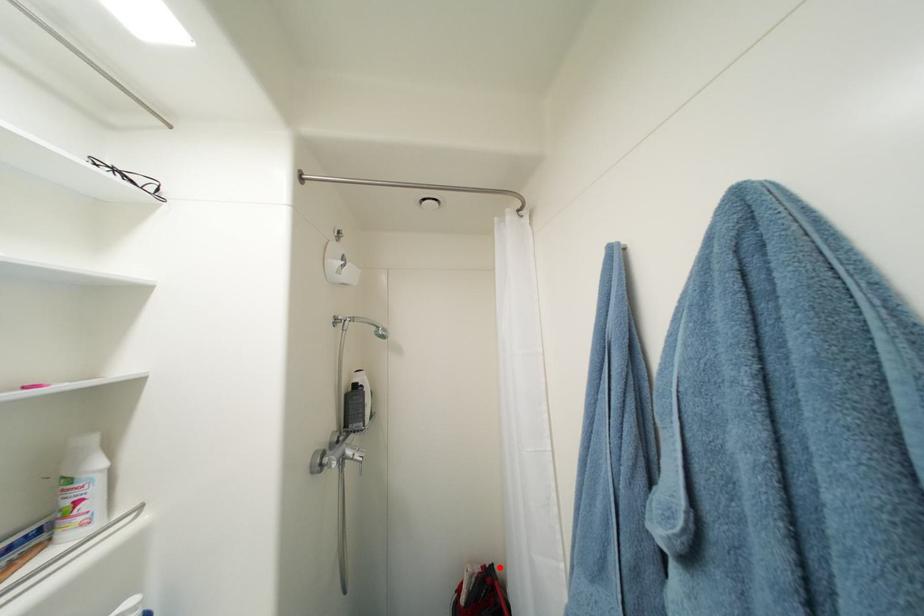
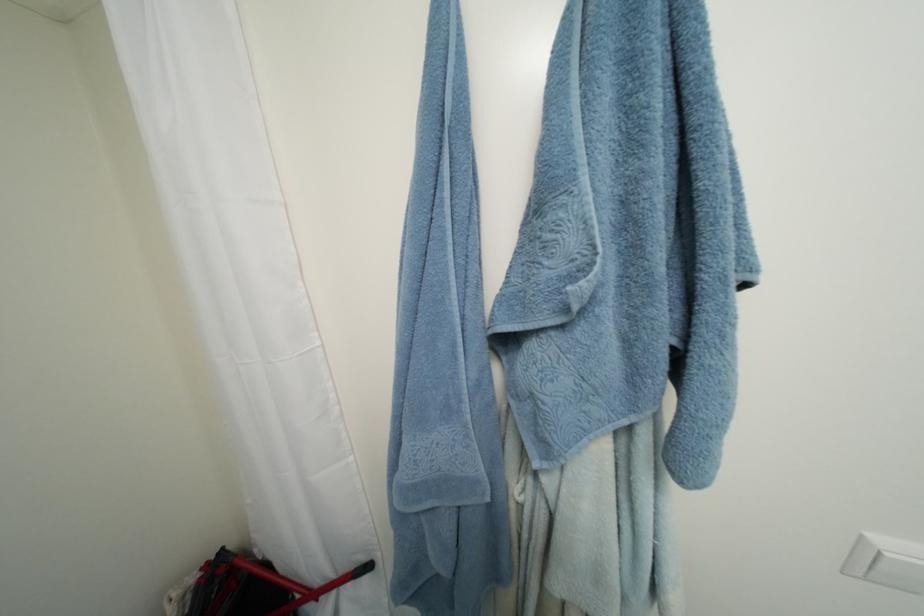
Locate, in the second image, the point that corresponds to the highlighted location in the first image.

(229, 552)